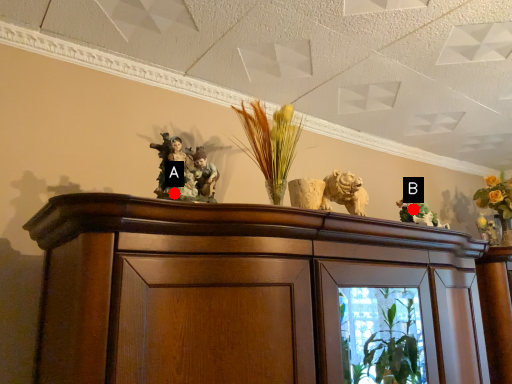
Question: Two points are circled on the image, labeled by A and B beside each circle. Which point is farther from the camera taking this photo?

Choices:
 (A) A is further
 (B) B is further

Answer: (B)